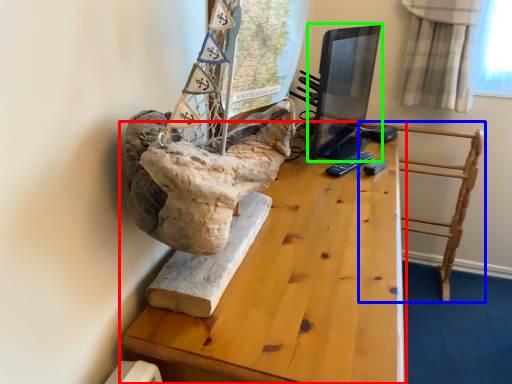
Question: Which object is positioned farthest from table (highlighted by a red box)? Select from furniture (highlighted by a blue box) and computer monitor (highlighted by a green box).

Choices:
 (A) furniture
 (B) computer monitor

Answer: (B)